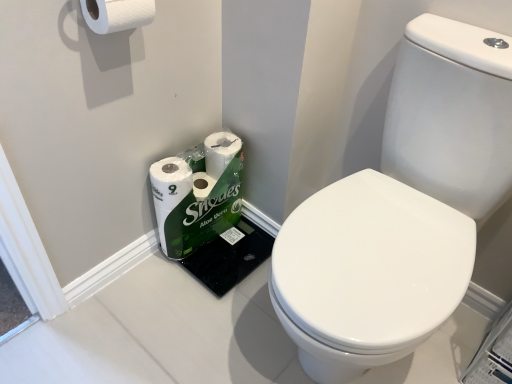
Question: Is white matte toilet paper at upper left, the first toilet paper viewed from the top, with white glossy toilet at center?

Choices:
 (A) yes
 (B) no

Answer: (B)

Question: Would you consider white matte toilet paper at upper left, the second toilet paper when ordered from bottom to top, to be distant from white glossy toilet at center?

Choices:
 (A) yes
 (B) no

Answer: (B)

Question: Does white matte toilet paper at upper left, the second toilet paper when ordered from bottom to top, have a lesser width compared to white glossy toilet at center?

Choices:
 (A) yes
 (B) no

Answer: (A)

Question: Is white matte toilet paper at upper left, marked as the 2th toilet paper in a back-to-front arrangement, facing away from white glossy toilet at center?

Choices:
 (A) no
 (B) yes

Answer: (A)

Question: Is white matte toilet paper at upper left, marked as the 2th toilet paper in a back-to-front arrangement, further to camera compared to white glossy toilet at center?

Choices:
 (A) no
 (B) yes

Answer: (B)

Question: From the image's perspective, is white glossy toilet at center above or below white matte toilet paper at upper left, the second toilet paper when ordered from bottom to top?

Choices:
 (A) below
 (B) above

Answer: (A)

Question: In the image, is white glossy toilet at center on the left side or the right side of white matte toilet paper at upper left, the second toilet paper when ordered from bottom to top?

Choices:
 (A) right
 (B) left

Answer: (A)

Question: Is point (387, 299) closer or farther from the camera than point (99, 11)?

Choices:
 (A) farther
 (B) closer

Answer: (B)

Question: Relative to white matte toilet paper at upper left, the first toilet paper viewed from the top, is white glossy toilet at center in front or behind?

Choices:
 (A) front
 (B) behind

Answer: (A)

Question: Is white glossy toilet paper at lower left, the second toilet paper in the front-to-back sequence, spatially inside white glossy toilet at center, or outside of it?

Choices:
 (A) inside
 (B) outside

Answer: (B)

Question: Based on their positions, is white glossy toilet paper at lower left, the first toilet paper from the back, located to the left or right of white glossy toilet at center?

Choices:
 (A) right
 (B) left

Answer: (B)

Question: From a real-world perspective, is white glossy toilet paper at lower left, marked as the 2th toilet paper in a top-to-bottom arrangement, above or below white glossy toilet at center?

Choices:
 (A) above
 (B) below

Answer: (B)

Question: In terms of size, does white glossy toilet paper at lower left, marked as the 2th toilet paper in a top-to-bottom arrangement, appear bigger or smaller than white glossy toilet at center?

Choices:
 (A) small
 (B) big

Answer: (A)

Question: From the image's perspective, is white glossy toilet at center above or below white glossy toilet paper at lower left, the first toilet paper from the back?

Choices:
 (A) above
 (B) below

Answer: (B)

Question: Considering the relative positions of white glossy toilet at center and white glossy toilet paper at lower left, acting as the first toilet paper starting from the bottom, in the image provided, is white glossy toilet at center to the left or to the right of white glossy toilet paper at lower left, acting as the first toilet paper starting from the bottom,?

Choices:
 (A) right
 (B) left

Answer: (A)